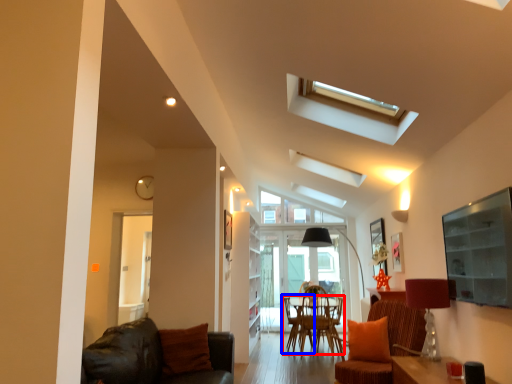
Question: Which object appears farthest to the camera in this image, chair (highlighted by a red box) or armchair (highlighted by a blue box)?

Choices:
 (A) chair
 (B) armchair

Answer: (B)